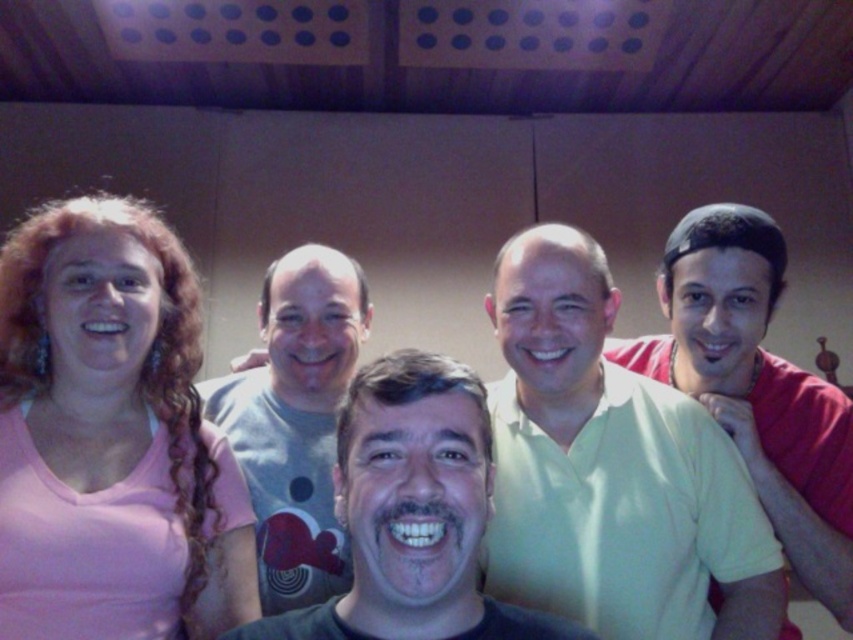
Question: Is light yellow shirt at center positioned before pink matte shirt at left?

Choices:
 (A) no
 (B) yes

Answer: (A)

Question: Does black matte shirt at center have a greater width compared to light yellow t-shirt at right?

Choices:
 (A) yes
 (B) no

Answer: (A)

Question: Can you confirm if pink matte shirt at left is positioned above black matte shirt at center?

Choices:
 (A) yes
 (B) no

Answer: (A)

Question: Which object is positioned closest to the black matte shirt at center?

Choices:
 (A) gray cotton t-shirt at center
 (B) pink matte shirt at left
 (C) light yellow shirt at center
 (D) light yellow t-shirt at right

Answer: (C)

Question: Which point is closer to the camera taking this photo?

Choices:
 (A) (782, 442)
 (B) (280, 273)
 (C) (555, 304)
 (D) (144, 292)

Answer: (C)

Question: Which point appears closest to the camera in this image?

Choices:
 (A) (271, 340)
 (B) (0, 317)

Answer: (B)